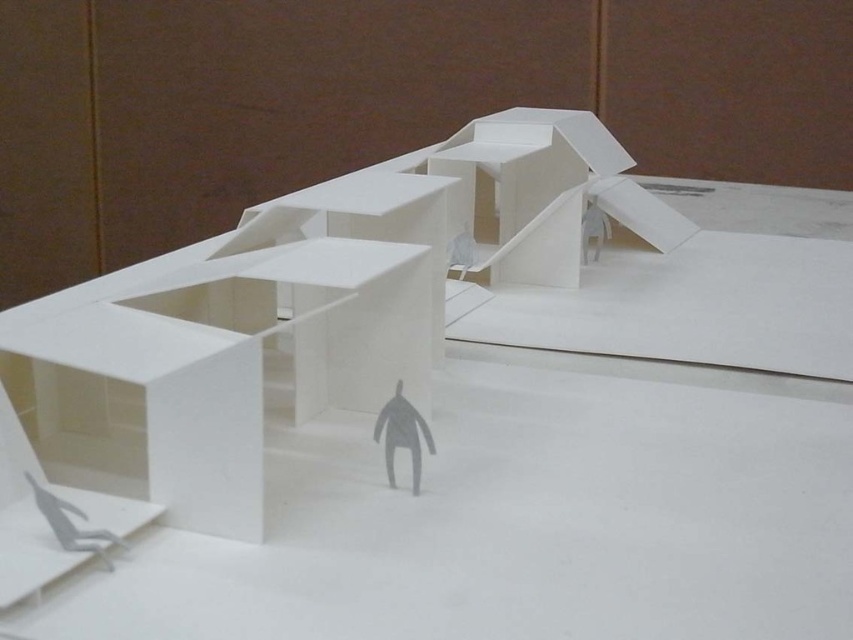
You are an architect examining the architectural model. You need to place a new small decorative item exactly at the center of the white matte table at center. Where should you place it?

The center of the white matte table at center is located at point (433,456), so place the decorative item there.

You are a visitor at an architectural exhibition and see the white matte table at center and the gray matte figure at center in the model. Which object is taller in the model?

The white matte table at center is much taller than the gray matte figure at center in the model.